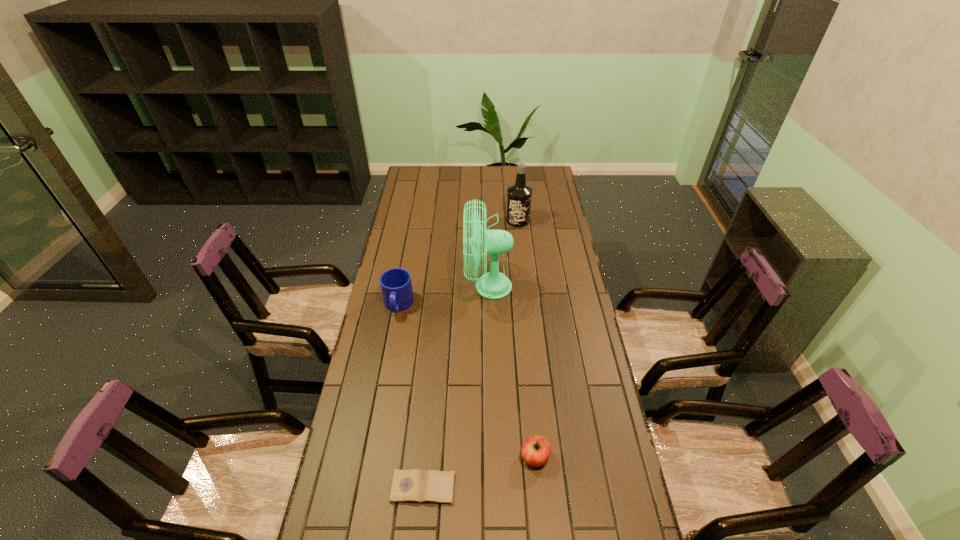
Where is `vacant area situated in front of the fan to blow air`? The width and height of the screenshot is (960, 540). vacant area situated in front of the fan to blow air is located at coordinates (452, 287).

I want to click on vacant space positioned on the front label of the fourth shortest object, so [523, 271].

You are a GUI agent. You are given a task and a screenshot of the screen. Output one action in this format:
    pyautogui.click(x=<x>, y=<y>)
    Task: Click on the vacant position located on the side with the handle of the mug
    The image size is (960, 540).
    Given the screenshot: What is the action you would take?
    pyautogui.click(x=391, y=345)

Locate an element on the screen. Image resolution: width=960 pixels, height=540 pixels. vacant region located on the back of the apple is located at coordinates (526, 365).

I want to click on vacant space located on the back of the diary, so click(x=430, y=410).

Locate an element on the screen. This screenshot has height=540, width=960. mug located at the left edge is located at coordinates (396, 285).

Locate an element on the screen. This screenshot has width=960, height=540. diary positioned at the left edge is located at coordinates (409, 486).

Where is `free region at the far edge`? Image resolution: width=960 pixels, height=540 pixels. free region at the far edge is located at coordinates (506, 167).

This screenshot has width=960, height=540. In the image, there is a desktop. In order to click on vacant space at the left edge in this screenshot , I will do `click(405, 267)`.

You are a GUI agent. You are given a task and a screenshot of the screen. Output one action in this format:
    pyautogui.click(x=<x>, y=<y>)
    Task: Click on the free region at the right edge of the desktop
    Image resolution: width=960 pixels, height=540 pixels.
    Given the screenshot: What is the action you would take?
    557,274